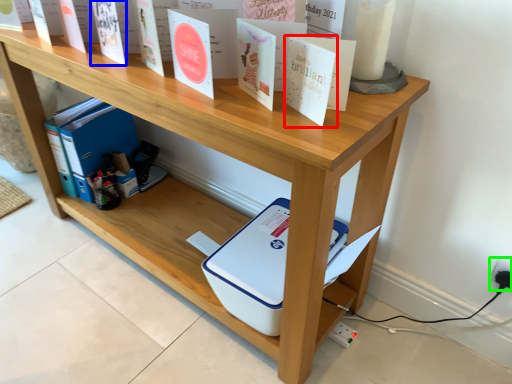
Question: Which object is positioned closest to paperback book (highlighted by a red box)? Select from paperback book (highlighted by a blue box) and electric outlet (highlighted by a green box).

Choices:
 (A) paperback book
 (B) electric outlet

Answer: (A)